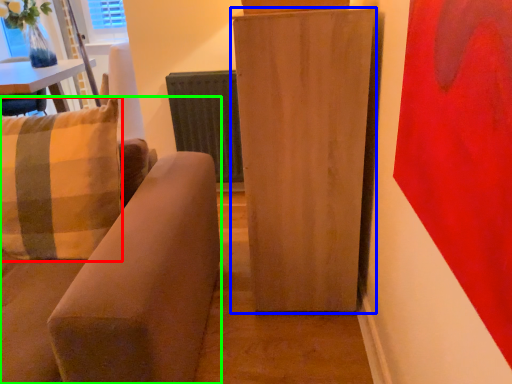
Question: Estimate the real-world distances between objects in this image. Which object is farther from pillow (highlighted by a red box), furniture (highlighted by a blue box) or studio couch (highlighted by a green box)?

Choices:
 (A) furniture
 (B) studio couch

Answer: (A)